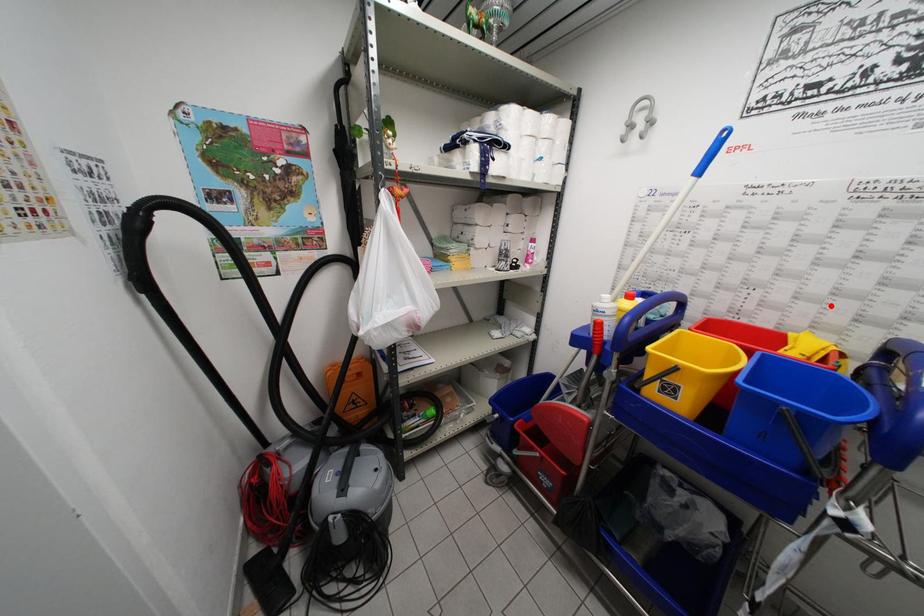
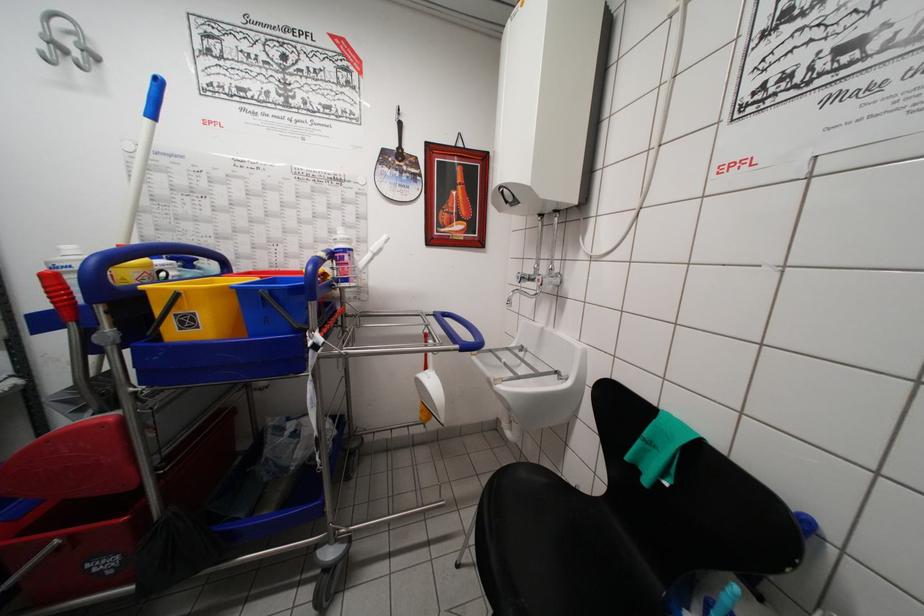
In the second image, find the point that corresponds to the highlighted location in the first image.

(319, 252)